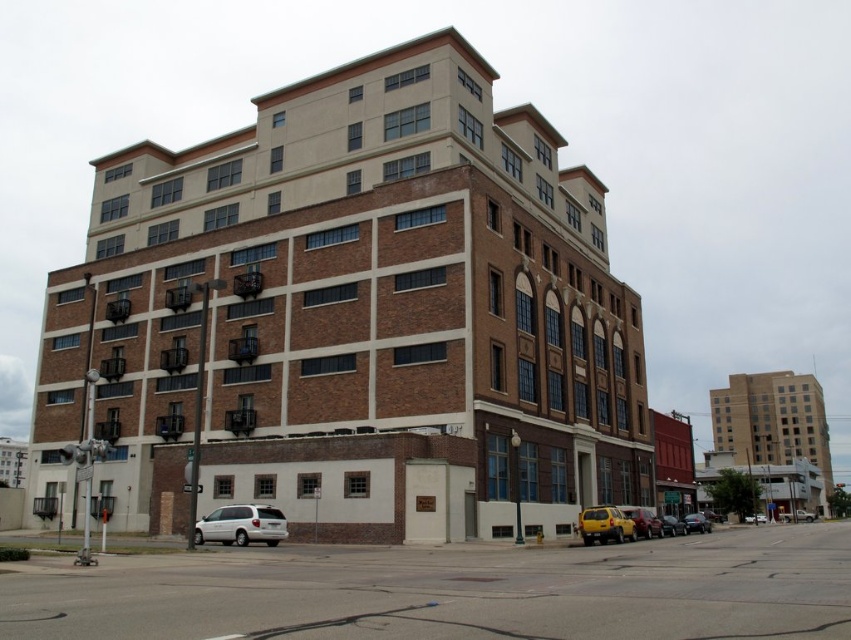
Can you confirm if concrete sidewalk at lower center is smaller than metallic yellow van at lower right?

No.

What do you see at coordinates (454, 592) in the screenshot? The width and height of the screenshot is (851, 640). I see `concrete sidewalk at lower center` at bounding box center [454, 592].

What do you see at coordinates (454, 592) in the screenshot? This screenshot has height=640, width=851. I see `concrete sidewalk at lower center` at bounding box center [454, 592].

This screenshot has height=640, width=851. I want to click on concrete sidewalk at lower center, so click(454, 592).

Is point (210, 513) more distant than point (681, 524)?

No, it is not.

In the scene shown: Who is more distant from viewer, (x=281, y=524) or (x=672, y=520)?

The point (x=672, y=520) is behind.

Who is more forward, [220,529] or [665,522]?

Positioned in front is point [220,529].

Locate an element on the screen. This screenshot has width=851, height=640. white matte van at lower left is located at coordinates (241, 525).

Can you confirm if yellow matte car at lower right is positioned below shiny black sedan at center?

No.

Is point (590, 532) positioned in front of point (709, 522)?

Yes, it is.

Locate an element on the screen. The image size is (851, 640). yellow matte car at lower right is located at coordinates (604, 525).